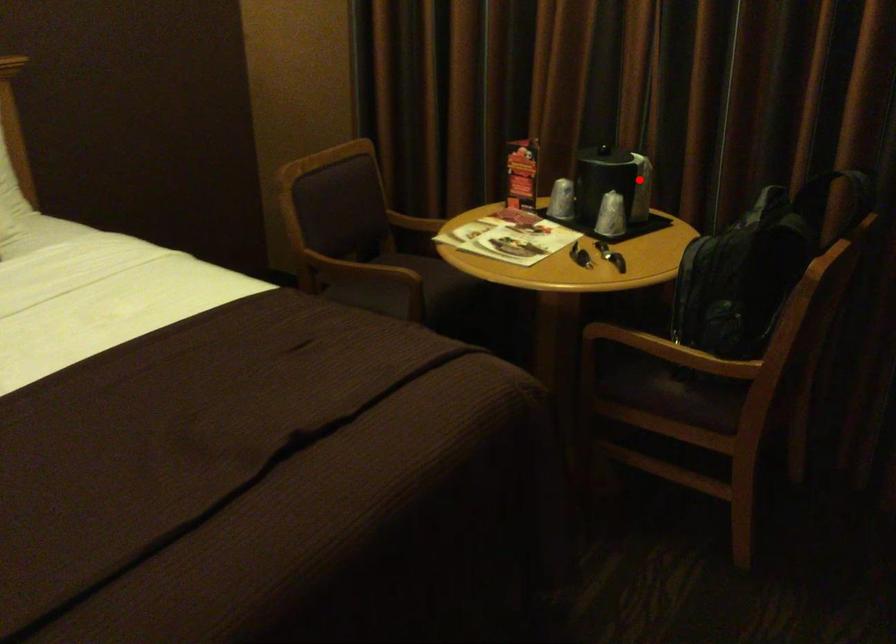
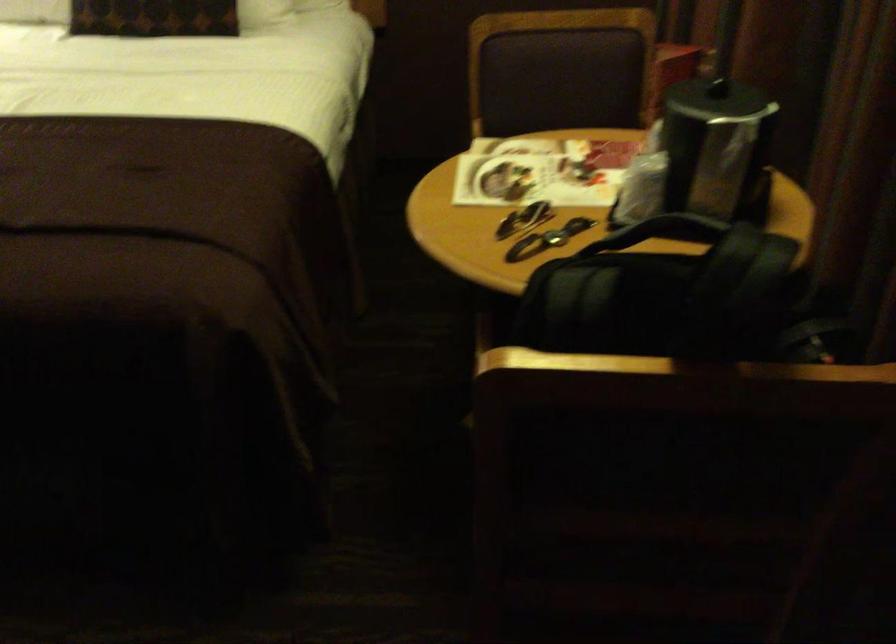
Question: I am providing you with two images of the same scene from different viewpoints. In image1, a red point is highlighted. Considering the same 3D point in image2, which of the following is correct?

Choices:
 (A) It is closer
 (B) It is farther

Answer: (A)